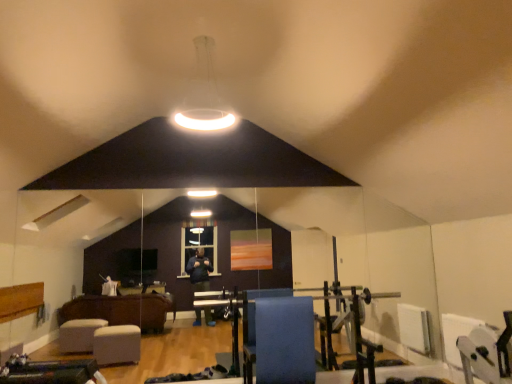
Identify the location of blue fabric at center. The width and height of the screenshot is (512, 384). (285, 340).

Describe the element at coordinates (285, 340) in the screenshot. I see `blue fabric at center` at that location.

The image size is (512, 384). I want to click on blue fabric at center, so (x=285, y=340).